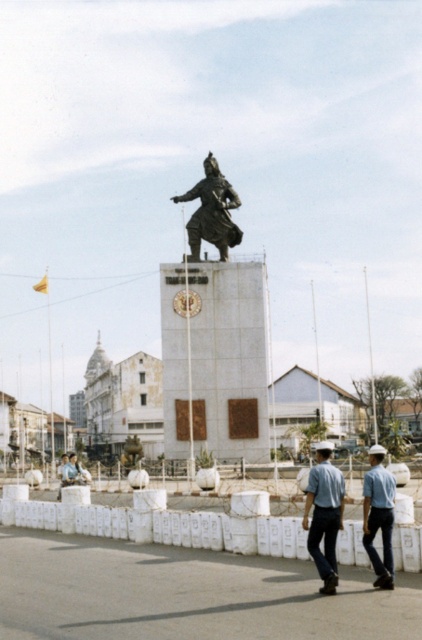
Is white plastic bags at center smaller than blue uniform at lower center?

Actually, white plastic bags at center might be larger than blue uniform at lower center.

Can you confirm if white plastic bags at center is positioned to the right of blue uniform at lower center?

No, white plastic bags at center is not to the right of blue uniform at lower center.

Which is behind, point (286, 518) or point (330, 525)?

The point (286, 518) is behind.

Locate an element on the screen. The height and width of the screenshot is (640, 422). white plastic bags at center is located at coordinates (192, 529).

Is blue uniform at lower center wider than light blue uniform at center?

No.

Does blue uniform at lower center appear under light blue uniform at center?

Yes, blue uniform at lower center is below light blue uniform at center.

Locate an element on the screen. The height and width of the screenshot is (640, 422). blue uniform at lower center is located at coordinates (324, 515).

Does point (235, 192) come in front of point (389, 580)?

No.

Who is positioned more to the left, bronze statue at center or light blue uniform at center?

bronze statue at center

The height and width of the screenshot is (640, 422). In order to click on bronze statue at center in this screenshot , I will do `click(211, 211)`.